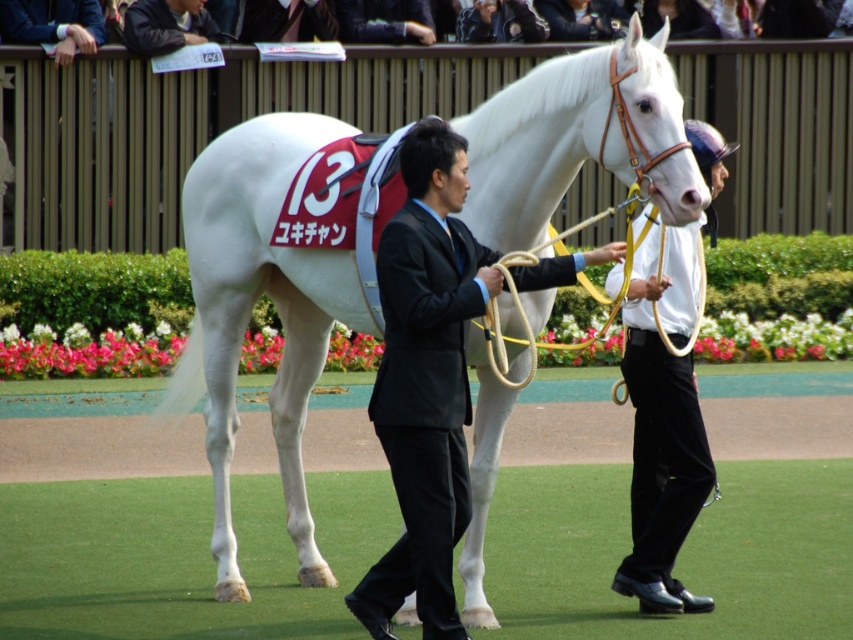
Does point (688, 406) lie behind point (532, 36)?

No, (688, 406) is in front of (532, 36).

Is white leather helmet at upper right to the right of dark brown leather jacket at upper center from the viewer's perspective?

Yes, white leather helmet at upper right is to the right of dark brown leather jacket at upper center.

Is point (672, 545) positioned behind point (469, 42)?

That is False.

This screenshot has height=640, width=853. Find the location of `white leather helmet at upper right`. white leather helmet at upper right is located at coordinates (663, 419).

Can you confirm if white glossy horse at center is positioned below black leather jacket at upper center?

Indeed, white glossy horse at center is positioned under black leather jacket at upper center.

This screenshot has width=853, height=640. What do you see at coordinates (253, 301) in the screenshot?
I see `white glossy horse at center` at bounding box center [253, 301].

Is point (242, 128) positioned behind point (415, 42)?

No.

I want to click on white glossy horse at center, so click(253, 301).

Which is behind, point (689, 440) or point (281, 16)?

Positioned behind is point (281, 16).

Does point (666, 248) come closer to viewer compared to point (312, 35)?

That is True.

Who is more distant from viewer, (628, 563) or (265, 38)?

The point (265, 38) is more distant.

The height and width of the screenshot is (640, 853). I want to click on white leather helmet at upper right, so click(x=663, y=419).